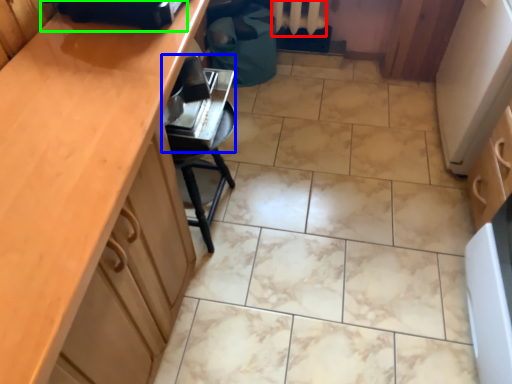
Question: Which is nearer to the radiator (highlighted by a red box)? appliance (highlighted by a blue box) or appliance (highlighted by a green box).

Choices:
 (A) appliance
 (B) appliance

Answer: (A)